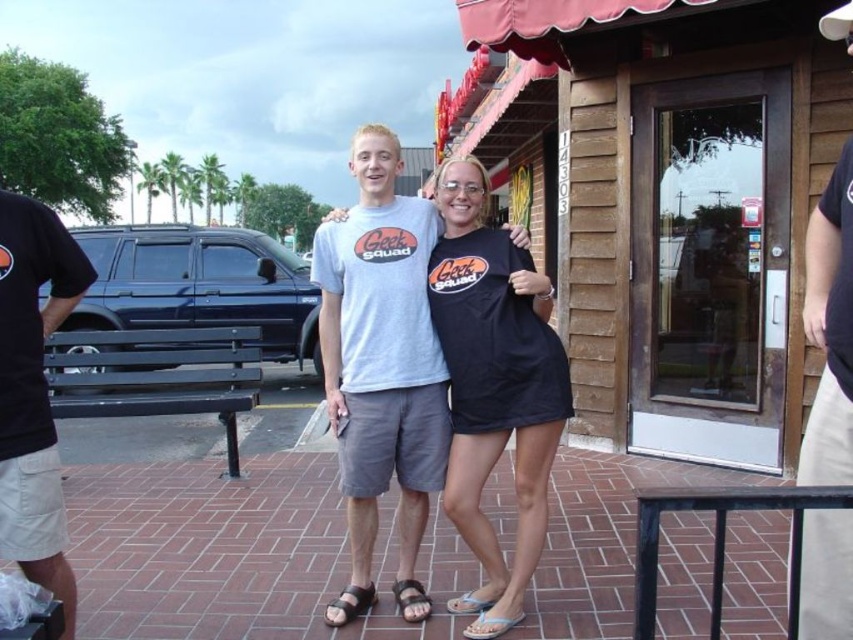
Does gray cotton t-shirt at center come behind brown leather sandal at lower center?

No.

Is gray cotton t-shirt at center closer to camera compared to brown leather sandal at lower center?

Yes, gray cotton t-shirt at center is in front of brown leather sandal at lower center.

Who is more forward, [328,236] or [347,593]?

Point [328,236] is in front.

Locate an element on the screen. gray cotton t-shirt at center is located at coordinates (381, 353).

Who is more distant from viewer, (525, 477) or (343, 588)?

The point (343, 588) is behind.

Does black cotton dress at center have a greater height compared to brown leather sandal at lower center?

Yes, black cotton dress at center is taller than brown leather sandal at lower center.

Find the location of a particular element. The image size is (853, 640). black cotton dress at center is located at coordinates (495, 372).

Consider the image. Does black cotton shirt at center have a lesser height compared to brown leather sandal at center?

Incorrect, black cotton shirt at center's height does not fall short of brown leather sandal at center's.

Find the location of a particular element. This screenshot has height=640, width=853. black cotton shirt at center is located at coordinates (830, 330).